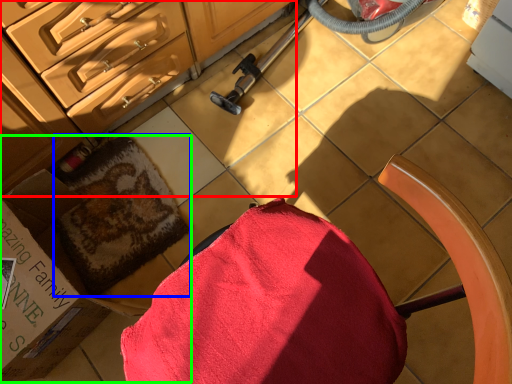
Question: Which is farther away from cabinetry (highlighted by a red box)? bath towel (highlighted by a blue box) or box (highlighted by a green box)?

Choices:
 (A) bath towel
 (B) box

Answer: (A)